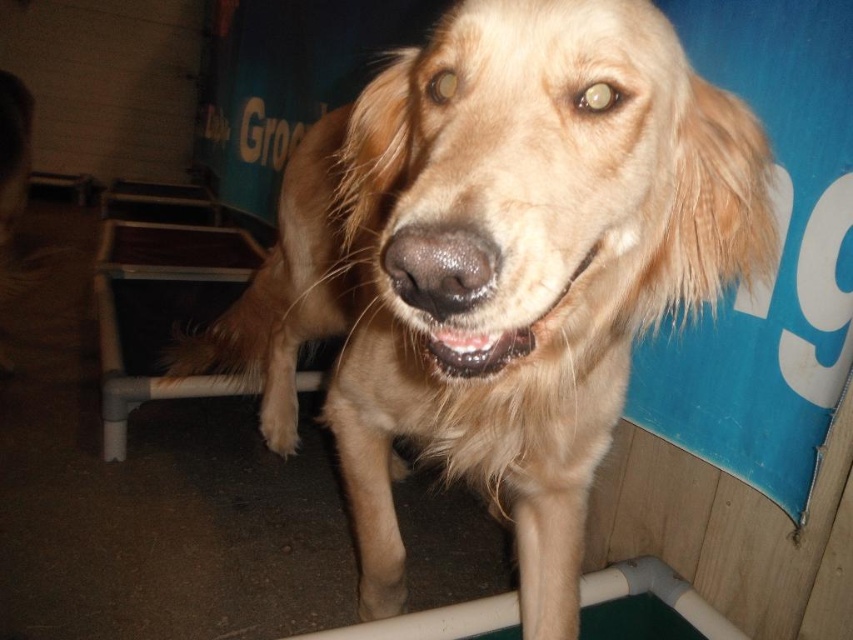
Question: Which point is closer to the camera?

Choices:
 (A) (576, 356)
 (B) (431, 353)

Answer: (B)

Question: Does golden fur dog at center come in front of shiny brown teeth at center?

Choices:
 (A) no
 (B) yes

Answer: (B)

Question: Where is golden fur dog at center located in relation to shiny brown teeth at center in the image?

Choices:
 (A) right
 (B) left

Answer: (B)

Question: Is golden fur dog at center below shiny brown teeth at center?

Choices:
 (A) no
 (B) yes

Answer: (B)

Question: Among these points, which one is nearest to the camera?

Choices:
 (A) (508, 349)
 (B) (521, 486)

Answer: (A)